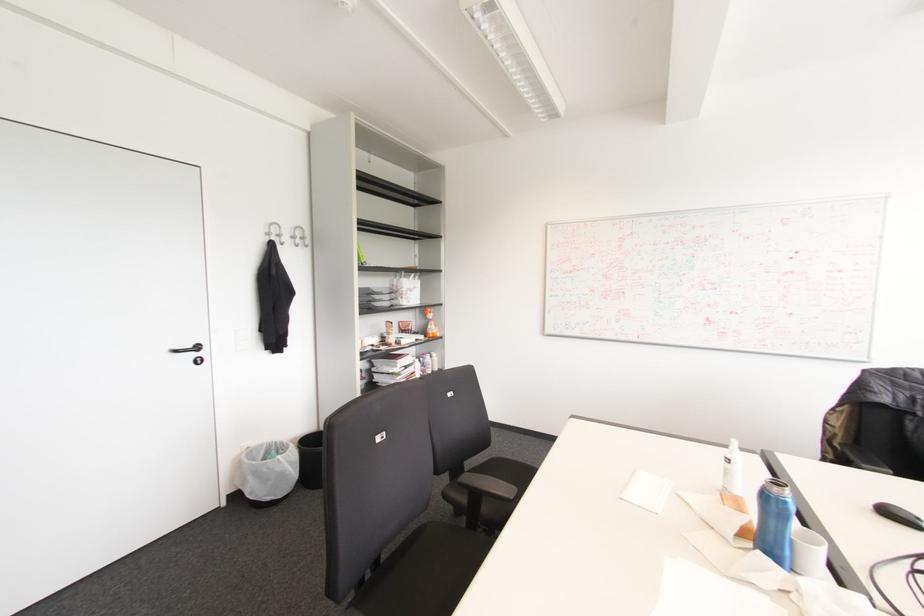
The location [266,469] corresponds to which object?

This point indicates the black trash can.